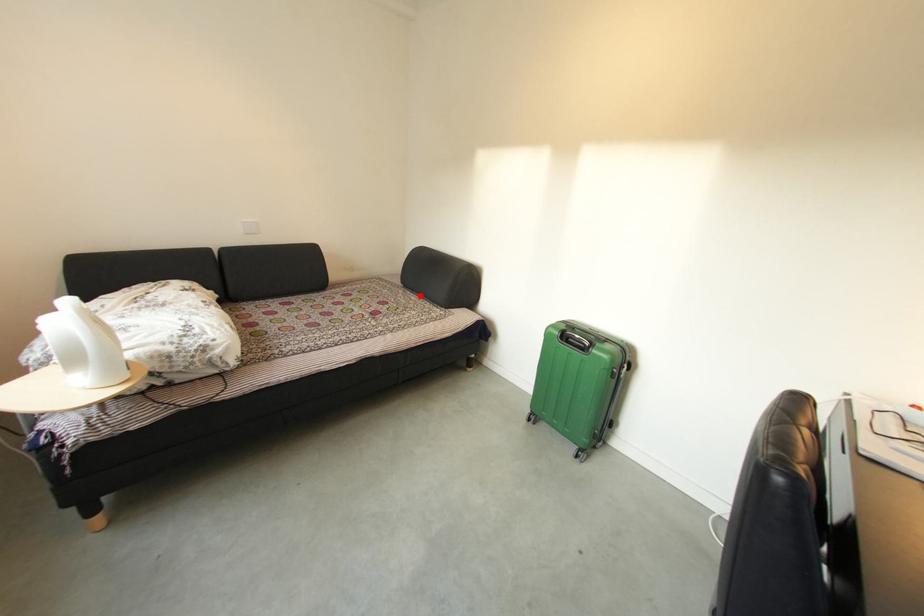
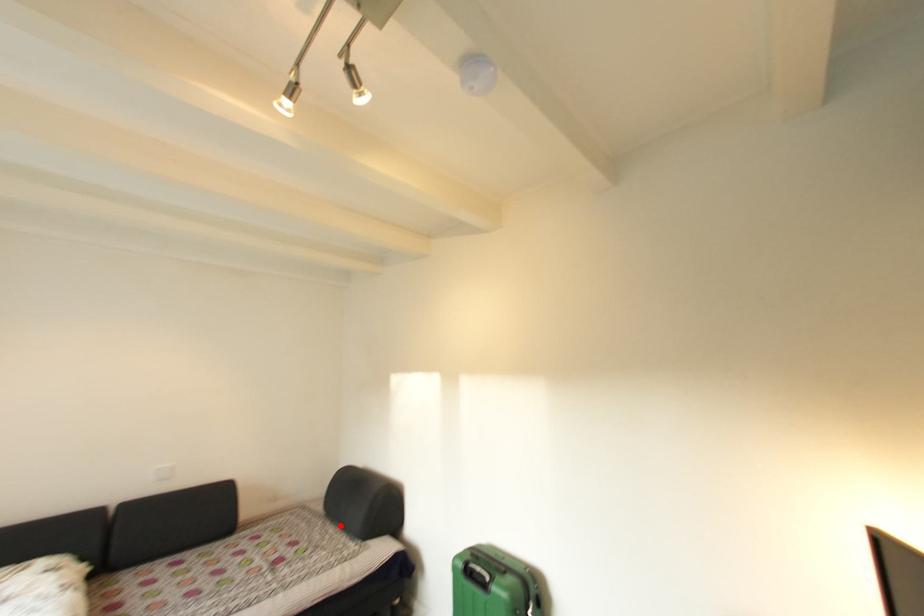
I am providing you with two images of the same scene from different viewpoints. A red point is marked on the first image and another point is marked on the second image. Is the marked point in image1 the same physical position as the marked point in image2?

Yes